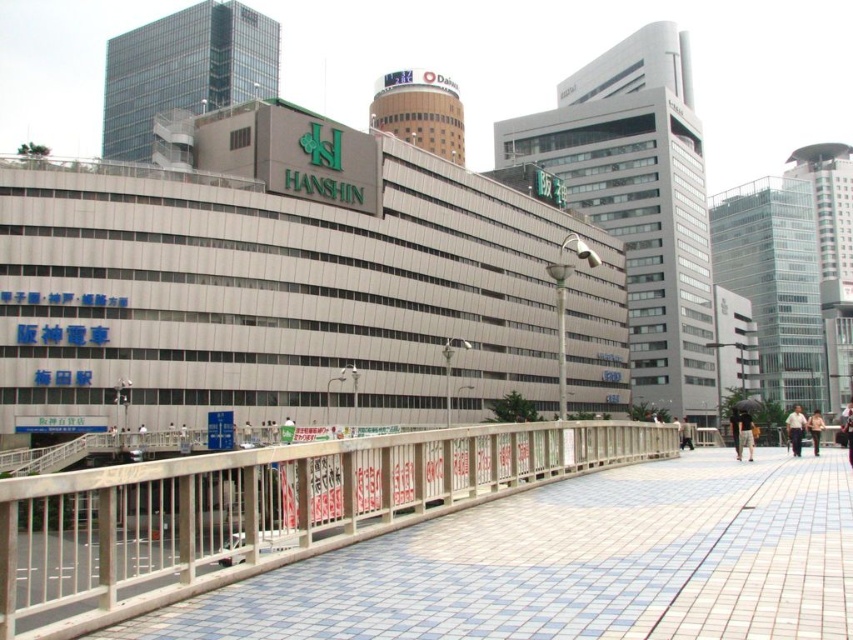
Who is positioned more to the left, blue tile pavement at lower left or dark brown leather jacket at center?

blue tile pavement at lower left is more to the left.

Who is higher up, blue tile pavement at lower left or dark brown leather jacket at center?

Positioned higher is dark brown leather jacket at center.

Which is in front, point (410, 556) or point (738, 417)?

Point (410, 556) is more forward.

This screenshot has height=640, width=853. Identify the location of blue tile pavement at lower left. (573, 564).

Does blue tile pavement at lower left lie in front of light brown fabric shirt at right?

Yes, blue tile pavement at lower left is closer to the viewer.

Is blue tile pavement at lower left to the right of light brown fabric shirt at right from the viewer's perspective?

Incorrect, blue tile pavement at lower left is not on the right side of light brown fabric shirt at right.

Between point (541, 604) and point (799, 452), which one is positioned in front?

Point (541, 604) is more forward.

The image size is (853, 640). What are the coordinates of `blue tile pavement at lower left` in the screenshot? It's located at (573, 564).

Does dark brown leather jacket at center appear under light brown leather jacket at lower right?

Incorrect, dark brown leather jacket at center is not positioned below light brown leather jacket at lower right.

Does dark brown leather jacket at center appear on the right side of light brown leather jacket at lower right?

In fact, dark brown leather jacket at center is to the left of light brown leather jacket at lower right.

The height and width of the screenshot is (640, 853). Describe the element at coordinates (744, 433) in the screenshot. I see `dark brown leather jacket at center` at that location.

You are a GUI agent. You are given a task and a screenshot of the screen. Output one action in this format:
    pyautogui.click(x=<x>, y=<y>)
    Task: Click on the dark brown leather jacket at center
    
    Given the screenshot: What is the action you would take?
    pyautogui.click(x=744, y=433)